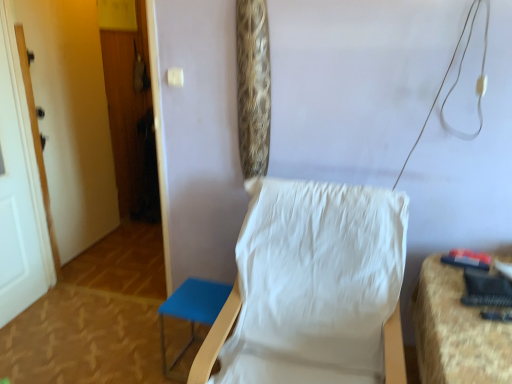
Question: Considering the relative positions of white fabric chair at center and blue fabric stool at lower left, the 1th furniture viewed from the left, in the image provided, is white fabric chair at center to the left of blue fabric stool at lower left, the 1th furniture viewed from the left, from the viewer's perspective?

Choices:
 (A) yes
 (B) no

Answer: (B)

Question: Does white fabric chair at center turn towards blue fabric stool at lower left, which is the second furniture from right to left?

Choices:
 (A) no
 (B) yes

Answer: (A)

Question: From a real-world perspective, is white fabric chair at center over blue fabric stool at lower left, which is the second furniture from right to left?

Choices:
 (A) no
 (B) yes

Answer: (B)

Question: From the image's perspective, is white fabric chair at center located beneath blue fabric stool at lower left, the 1th furniture viewed from the left?

Choices:
 (A) yes
 (B) no

Answer: (B)

Question: Is white fabric chair at center touching blue fabric stool at lower left, the 1th furniture viewed from the left?

Choices:
 (A) yes
 (B) no

Answer: (B)

Question: Based on their sizes in the image, would you say white painted wood door at left, the 2th door in the front-to-back sequence, is bigger or smaller than white painted wood door at left, the 2th door in the back-to-front sequence?

Choices:
 (A) small
 (B) big

Answer: (A)

Question: Is white painted wood door at left, the 2th door in the front-to-back sequence, to the left or to the right of white painted wood door at left, the 2th door in the back-to-front sequence, in the image?

Choices:
 (A) left
 (B) right

Answer: (B)

Question: Is white painted wood door at left, which ranks as the first door in back-to-front order, spatially inside white painted wood door at left, acting as the 1th door starting from the front, or outside of it?

Choices:
 (A) inside
 (B) outside

Answer: (B)

Question: From the image's perspective, is white painted wood door at left, the 2th door in the front-to-back sequence, positioned above or below white painted wood door at left, the 2th door in the back-to-front sequence?

Choices:
 (A) below
 (B) above

Answer: (B)

Question: From their relative heights in the image, would you say textured fabric chair at right, placed as the 1th furniture when sorted from right to left, is taller or shorter than white painted wood door at left, acting as the 1th door starting from the front?

Choices:
 (A) short
 (B) tall

Answer: (A)

Question: Considering the positions of point (470, 306) and point (47, 228), is point (470, 306) closer or farther from the camera than point (47, 228)?

Choices:
 (A) closer
 (B) farther

Answer: (A)

Question: Is textured fabric chair at right, which is the 2th furniture from left to right, to the left or to the right of white painted wood door at left, the 2th door in the back-to-front sequence, in the image?

Choices:
 (A) left
 (B) right

Answer: (B)

Question: Considering the positions of textured fabric chair at right, which is the 2th furniture from left to right, and white painted wood door at left, the 2th door in the back-to-front sequence, in the image, is textured fabric chair at right, which is the 2th furniture from left to right, wider or thinner than white painted wood door at left, the 2th door in the back-to-front sequence,?

Choices:
 (A) thin
 (B) wide

Answer: (B)

Question: In the image, is white painted wood door at left, the 2th door in the front-to-back sequence, positioned in front of or behind textured fabric chair at right, which is the 2th furniture from left to right?

Choices:
 (A) behind
 (B) front

Answer: (A)

Question: From the image's perspective, is white painted wood door at left, which ranks as the first door in back-to-front order, located above or below textured fabric chair at right, placed as the 1th furniture when sorted from right to left?

Choices:
 (A) above
 (B) below

Answer: (A)